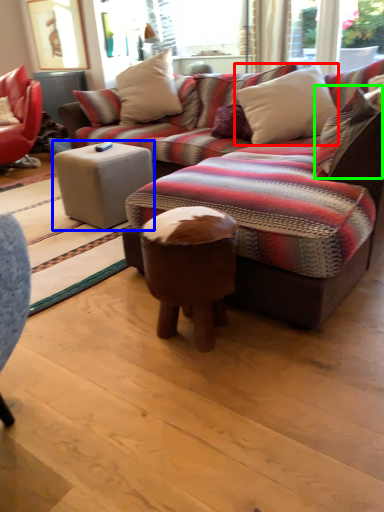
Question: Estimate the real-world distances between objects in this image. Which object is closer to pillow (highlighted by a red box), table (highlighted by a blue box) or pillow (highlighted by a green box)?

Choices:
 (A) table
 (B) pillow

Answer: (B)